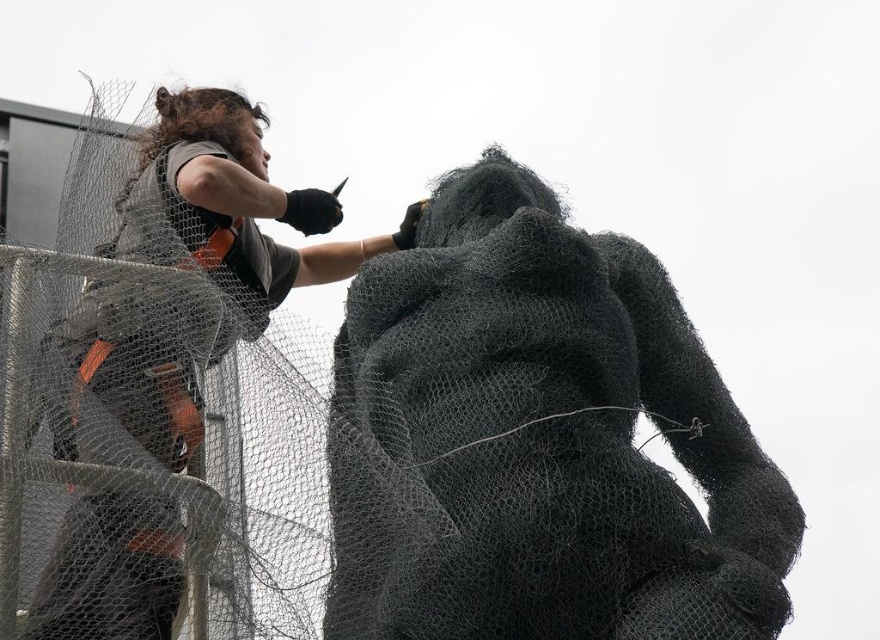
What object is located at the coordinates point (539, 440) in the scene?

The point (539, 440) indicates the textured wire mesh gorilla at center.

You are a delivery person who needs to place a small package on the ground near the textured wire mesh gorilla at center. The coordinates of the package must be within 0.1 units of the gorilla. What are the minimum and maximum x and y coordinates you can use for the package?

The textured wire mesh gorilla at center is located at point coordinates of [539,440]. To place the package within 0.1 units of the gorilla, the minimum x coordinate is 0.589 and the maximum x coordinate is 0.789. The minimum y coordinate is 0.513 and the maximum y coordinate is 0.713.

You are an art critic observing the sculpture installation. Based on the scene, which object is shorter between the textured wire mesh gorilla at center and the matte black shirt at upper left?

The textured wire mesh gorilla at center is shorter than the matte black shirt at upper left.